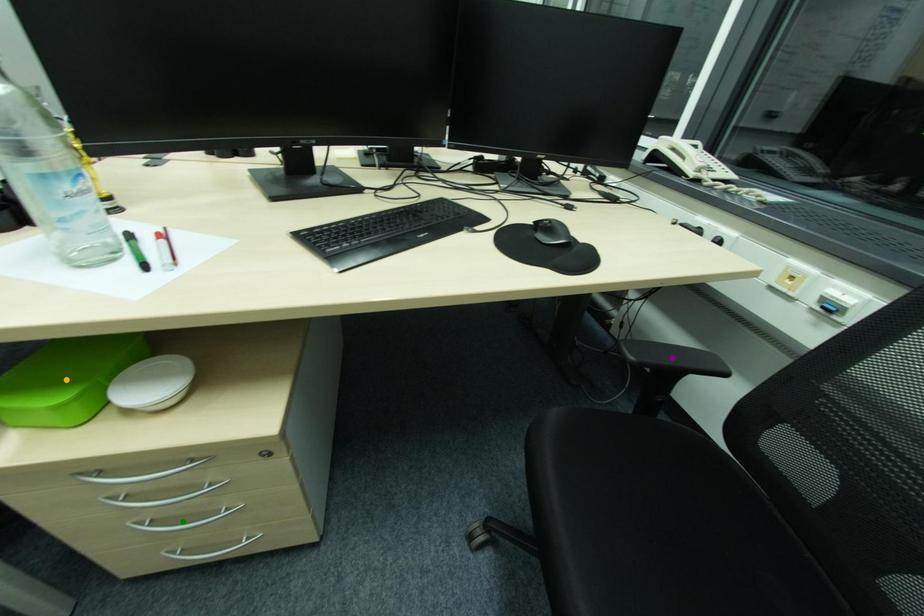
Order these from farthest to nearest:
orange point | purple point | green point

purple point
green point
orange point